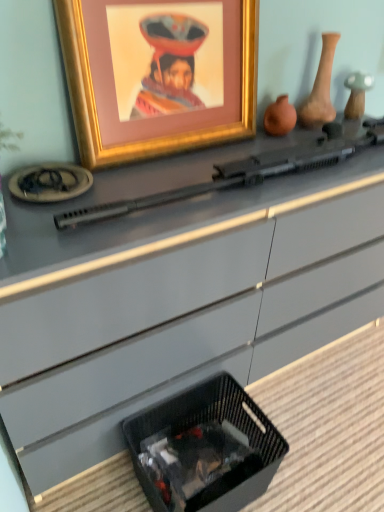
This screenshot has height=512, width=384. In order to click on vacant area that lies between matte clay vase at upper center, the first vase in the left-to-right sequence, and black plastic rifle at center in this screenshot , I will do `click(238, 152)`.